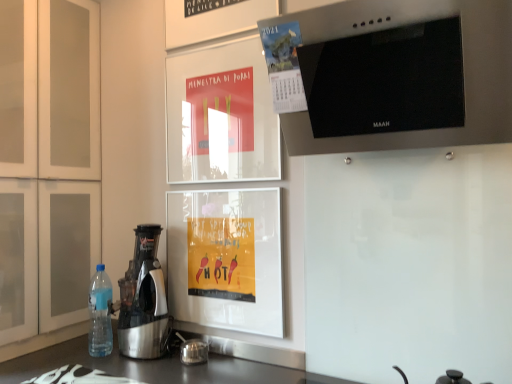
Based on the photo, in order to face stainless steel range hood at upper right, should I rotate leftwards or rightwards?

A 16.371 degree turn to the right will do.

Identify the location of metallic calendar at upper center. (284, 66).

The image size is (512, 384). What do you see at coordinates (100, 314) in the screenshot?
I see `blue plastic bottle at lower left` at bounding box center [100, 314].

Identify the location of stainless steel range hood at upper right. (464, 71).

Does blue plastic bottle at lower left appear on the right side of white matte cabinet at left?

Yes, blue plastic bottle at lower left is to the right of white matte cabinet at left.

From the image's perspective, between blue plastic bottle at lower left and white matte cabinet at left, which one is located above?

white matte cabinet at left appears higher in the image.

Can you confirm if blue plastic bottle at lower left is shorter than white matte cabinet at left?

Yes.

Is blue plastic bottle at lower left oriented towards white matte cabinet at left?

No, blue plastic bottle at lower left is not facing towards white matte cabinet at left.

Is white matte cabinet at left at the right side of metallic calendar at upper center?

No, white matte cabinet at left is not to the right of metallic calendar at upper center.

Considering the relative sizes of white matte cabinet at left and metallic calendar at upper center in the image provided, is white matte cabinet at left shorter than metallic calendar at upper center?

Incorrect, the height of white matte cabinet at left does not fall short of that of metallic calendar at upper center.

From the image's perspective, which is below, white matte cabinet at left or metallic calendar at upper center?

From the image's view, white matte cabinet at left is below.

Is metallic silver juicer at left looking in the opposite direction of blue plastic bottle at lower left?

No, metallic silver juicer at left is not facing away from blue plastic bottle at lower left.

Consider the image. What's the angular difference between metallic silver juicer at left and blue plastic bottle at lower left's facing directions?

There is a 0.000962-degree angle between the facing directions of metallic silver juicer at left and blue plastic bottle at lower left.

Can you confirm if metallic silver juicer at left is shorter than blue plastic bottle at lower left?

Incorrect, the height of metallic silver juicer at left does not fall short of that of blue plastic bottle at lower left.

From a real-world perspective, is metallic silver juicer at left positioned under blue plastic bottle at lower left based on gravity?

A: No, from a real-world perspective, metallic silver juicer at left is not beneath blue plastic bottle at lower left.

How far apart are stainless steel range hood at upper right and metallic calendar at upper center?

They are 8.19 inches apart.

The height and width of the screenshot is (384, 512). In order to click on home appliance above the metallic calendar at upper center (from a real-world perspective) in this screenshot , I will do `click(464, 71)`.

Is metallic calendar at upper center at the back of stainless steel range hood at upper right?

stainless steel range hood at upper right does not have its back to metallic calendar at upper center.

Is stainless steel range hood at upper right wider or thinner than metallic calendar at upper center?

In the image, stainless steel range hood at upper right appears to be wider than metallic calendar at upper center.

Is stainless steel range hood at upper right in front of or behind white matte cabinet at left in the image?

Clearly, stainless steel range hood at upper right is in front of white matte cabinet at left.

Is stainless steel range hood at upper right taller or shorter than white matte cabinet at left?

stainless steel range hood at upper right is shorter than white matte cabinet at left.

Based on their positions, is stainless steel range hood at upper right located to the left or right of white matte cabinet at left?

In the image, stainless steel range hood at upper right appears on the right side of white matte cabinet at left.

Which is further, (x=342, y=32) or (x=75, y=85)?

Positioned behind is point (x=75, y=85).

Considering the sizes of objects white matte cabinet at left and blue plastic bottle at lower left in the image provided, who is taller, white matte cabinet at left or blue plastic bottle at lower left?

white matte cabinet at left is taller.

Could you tell me if white matte cabinet at left is facing blue plastic bottle at lower left?

Yes.

Between white matte cabinet at left and blue plastic bottle at lower left, which one has smaller width?

With smaller width is blue plastic bottle at lower left.

Is the position of metallic calendar at upper center less distant than that of stainless steel range hood at upper right?

No, metallic calendar at upper center is further to the viewer.

Is there a large distance between metallic calendar at upper center and stainless steel range hood at upper right?

No, metallic calendar at upper center is not far from stainless steel range hood at upper right.

How much distance is there between metallic calendar at upper center and stainless steel range hood at upper right?

8.19 inches.

In the image, there is a white matte cabinet at left. Where is `bottle below it (from a real-world perspective)`? The image size is (512, 384). bottle below it (from a real-world perspective) is located at coordinates (100, 314).

I want to click on cabinetry below the metallic calendar at upper center (from the image's perspective), so click(48, 167).

From the image, which object appears to be farther from stainless steel range hood at upper right, white matte cabinet at left or metallic calendar at upper center?

white matte cabinet at left.

Estimate the real-world distances between objects in this image. Which object is further from stainless steel range hood at upper right, metallic silver juicer at left or white matte cabinet at left?

white matte cabinet at left is positioned further to the anchor stainless steel range hood at upper right.

Looking at the image, which one is located closer to metallic calendar at upper center, metallic silver juicer at left or blue plastic bottle at lower left?

metallic silver juicer at left is positioned closer to the anchor metallic calendar at upper center.

Looking at the image, which one is located closer to metallic calendar at upper center, stainless steel range hood at upper right or white matte cabinet at left?

The object closer to metallic calendar at upper center is stainless steel range hood at upper right.

From the image, which object appears to be farther from metallic calendar at upper center, stainless steel range hood at upper right or blue plastic bottle at lower left?

Among the two, blue plastic bottle at lower left is located further to metallic calendar at upper center.

Based on their spatial positions, is metallic silver juicer at left or metallic calendar at upper center further from stainless steel range hood at upper right?

metallic silver juicer at left is further to stainless steel range hood at upper right.

From the image, which object appears to be farther from stainless steel range hood at upper right, metallic calendar at upper center or metallic silver juicer at left?

The object further to stainless steel range hood at upper right is metallic silver juicer at left.

Considering their positions, is blue plastic bottle at lower left positioned further to stainless steel range hood at upper right than metallic silver juicer at left?

Based on the image, blue plastic bottle at lower left appears to be further to stainless steel range hood at upper right.

This screenshot has width=512, height=384. What are the coordinates of `poster between blue plastic bottle at lower left and stainless steel range hood at upper right in the horizontal direction` in the screenshot? It's located at (284, 66).

The width and height of the screenshot is (512, 384). Find the location of `kitchen appliance that lies between white matte cabinet at left and blue plastic bottle at lower left from top to bottom`. kitchen appliance that lies between white matte cabinet at left and blue plastic bottle at lower left from top to bottom is located at coordinates (144, 300).

Locate an element on the screen. The image size is (512, 384). kitchen appliance between metallic calendar at upper center and blue plastic bottle at lower left in the vertical direction is located at coordinates (144, 300).

Where is `kitchen appliance situated between white matte cabinet at left and stainless steel range hood at upper right from left to right`? This screenshot has height=384, width=512. kitchen appliance situated between white matte cabinet at left and stainless steel range hood at upper right from left to right is located at coordinates (144, 300).